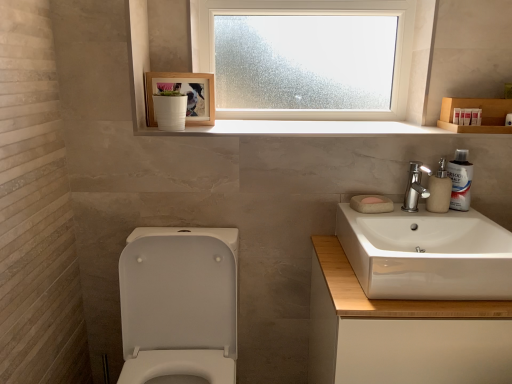
Question: From a real-world perspective, is white glossy toilet at lower left positioned above or below frosted glass window at upper center?

Choices:
 (A) above
 (B) below

Answer: (B)

Question: From the image's perspective, is white glossy toilet at lower left positioned above or below frosted glass window at upper center?

Choices:
 (A) above
 (B) below

Answer: (B)

Question: Which of these objects is positioned farthest from the white plastic toothpaste tube at upper right, the 2th toiletry positioned from the left?

Choices:
 (A) white plastic toothpaste tube at upper right, the first toiletry from the left
 (B) matte beige soap dispenser at right
 (C) white glossy toothpaste tube at upper right
 (D) white wood shelf at upper center
 (E) frosted glass window at upper center

Answer: (E)

Question: Estimate the real-world distances between objects in this image. Which object is farther from the white glossy toilet at lower left?

Choices:
 (A) wooden picture frame at upper center
 (B) polished chrome faucet at upper right
 (C) white glossy toothpaste tube at upper right
 (D) white glossy sink at right
 (E) white plastic toothpaste tube at upper right, the 2th toiletry positioned from the left

Answer: (E)